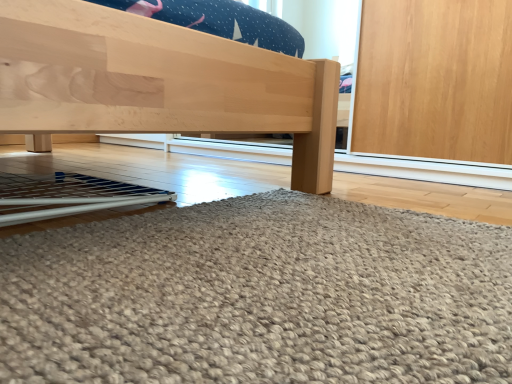
Question: Relative to natural wood bed frame at center, is wooden door at lower right in front or behind?

Choices:
 (A) front
 (B) behind

Answer: (A)

Question: In terms of height, does wooden door at lower right look taller or shorter compared to natural wood bed frame at center?

Choices:
 (A) short
 (B) tall

Answer: (A)

Question: Choose the correct answer: Is wooden door at lower right inside natural wood bed frame at center or outside it?

Choices:
 (A) inside
 (B) outside

Answer: (B)

Question: From the image's perspective, is natural wood bed frame at center above or below wooden door at lower right?

Choices:
 (A) above
 (B) below

Answer: (A)

Question: From a real-world perspective, relative to wooden door at lower right, is natural wood bed frame at center vertically above or below?

Choices:
 (A) below
 (B) above

Answer: (B)

Question: Is point (266, 66) closer or farther from the camera than point (35, 340)?

Choices:
 (A) closer
 (B) farther

Answer: (B)

Question: Is natural wood bed frame at center taller or shorter than wooden door at lower right?

Choices:
 (A) short
 (B) tall

Answer: (B)